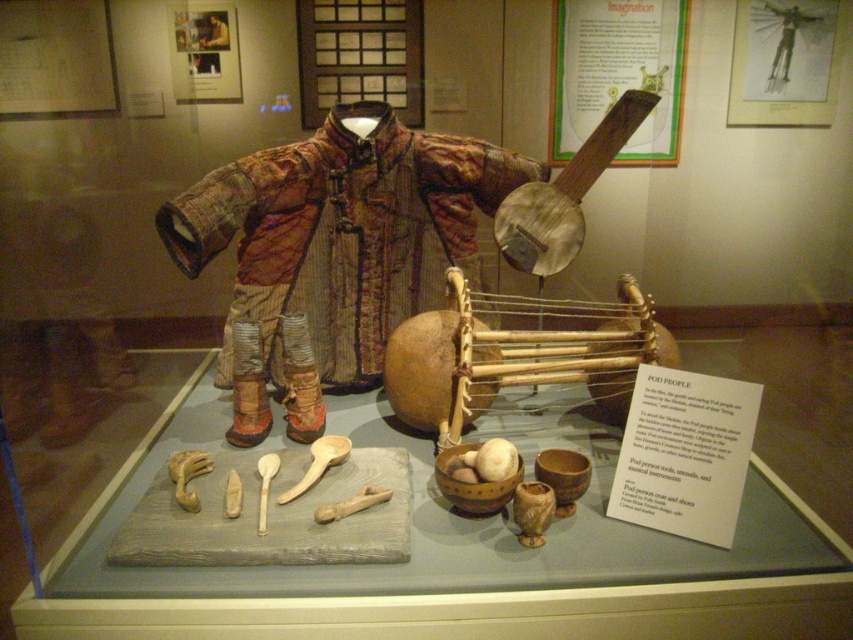
In the scene shown: You are a museum visitor who wants to take a photo of the wooden banjo at upper center without the textured brown fabric coat at center blocking the view. Is the coat large enough to block the banjo when placed in front of it?

The textured brown fabric coat at center is bigger than the wooden banjo at upper center, so it can block the view of the banjo if placed in front of it.

You are a museum visitor who wants to take a photo of the wooden banjo at upper center and the textured brown fabric coat at center. Based on their positions, which object should you focus on first to ensure both are in frame?

Since the textured brown fabric coat at center is to the left of the wooden banjo at upper center, you should focus on the wooden banjo at upper center first to ensure both objects are in frame.

You are a visitor at the museum and want to locate the point marked at coordinates (341, 234). Based on the scene description, where would this point be located?

The point marked at coordinates (341, 234) is located on the textured brown fabric coat at center.